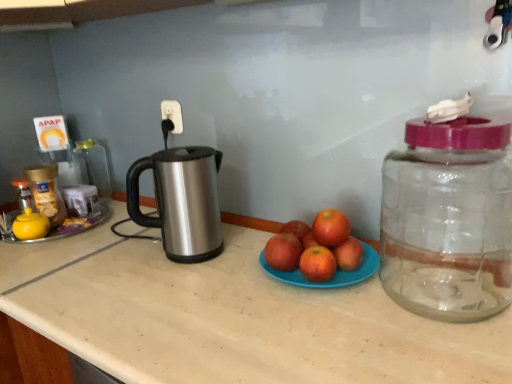
Image resolution: width=512 pixels, height=384 pixels. Find the location of `vacant area that is situated to the right of satin silver kettle at left`. vacant area that is situated to the right of satin silver kettle at left is located at coordinates (245, 245).